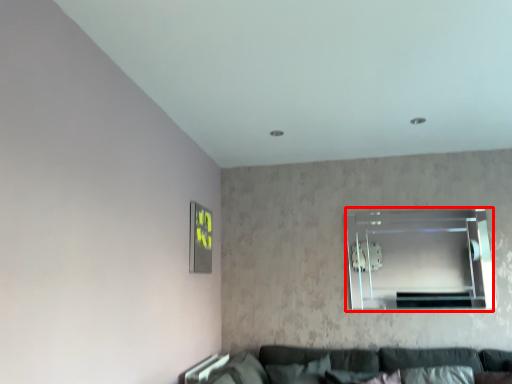
Question: From the image's perspective, where is window (annotated by the red box) located in relation to picture frame in the image?

Choices:
 (A) below
 (B) above

Answer: (A)